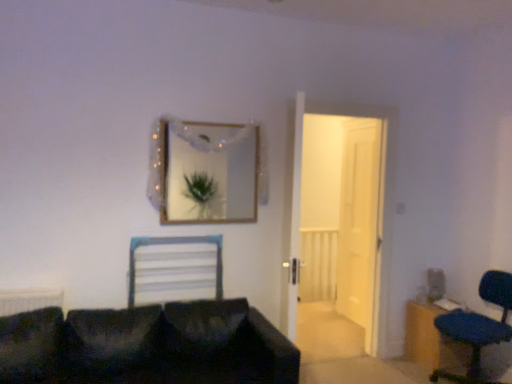
Question: Does blue fabric chair at lower right have a larger size compared to gold-framed mirror at upper center?

Choices:
 (A) no
 (B) yes

Answer: (B)

Question: Is gold-framed mirror at upper center located within blue fabric chair at lower right?

Choices:
 (A) no
 (B) yes

Answer: (A)

Question: From a real-world perspective, is blue fabric chair at lower right on gold-framed mirror at upper center?

Choices:
 (A) no
 (B) yes

Answer: (A)

Question: Can you confirm if blue fabric chair at lower right is wider than gold-framed mirror at upper center?

Choices:
 (A) yes
 (B) no

Answer: (A)

Question: Is blue fabric chair at lower right far away from gold-framed mirror at upper center?

Choices:
 (A) no
 (B) yes

Answer: (B)

Question: Is point (429, 365) positioned closer to the camera than point (174, 380)?

Choices:
 (A) farther
 (B) closer

Answer: (A)

Question: Is wooden dresser at lower right taller or shorter than black fabric couch at lower left?

Choices:
 (A) short
 (B) tall

Answer: (A)

Question: Relative to black fabric couch at lower left, is wooden dresser at lower right in front or behind?

Choices:
 (A) behind
 (B) front

Answer: (A)

Question: Is wooden dresser at lower right inside the boundaries of black fabric couch at lower left, or outside?

Choices:
 (A) inside
 (B) outside

Answer: (B)

Question: From the image's perspective, is gold-framed mirror at upper center positioned above or below white plastic chair at center?

Choices:
 (A) above
 (B) below

Answer: (A)

Question: Is gold-framed mirror at upper center inside the boundaries of white plastic chair at center, or outside?

Choices:
 (A) inside
 (B) outside

Answer: (B)

Question: Considering the positions of gold-framed mirror at upper center and white plastic chair at center in the image, is gold-framed mirror at upper center wider or thinner than white plastic chair at center?

Choices:
 (A) wide
 (B) thin

Answer: (B)

Question: From a real-world perspective, is gold-framed mirror at upper center positioned above or below white plastic chair at center?

Choices:
 (A) below
 (B) above

Answer: (B)

Question: In terms of width, does white wooden door at center, the 2th door from the front, look wider or thinner when compared to wooden dresser at lower right?

Choices:
 (A) thin
 (B) wide

Answer: (A)

Question: Is white wooden door at center, the 1th door from the back, to the left or to the right of wooden dresser at lower right in the image?

Choices:
 (A) right
 (B) left

Answer: (B)